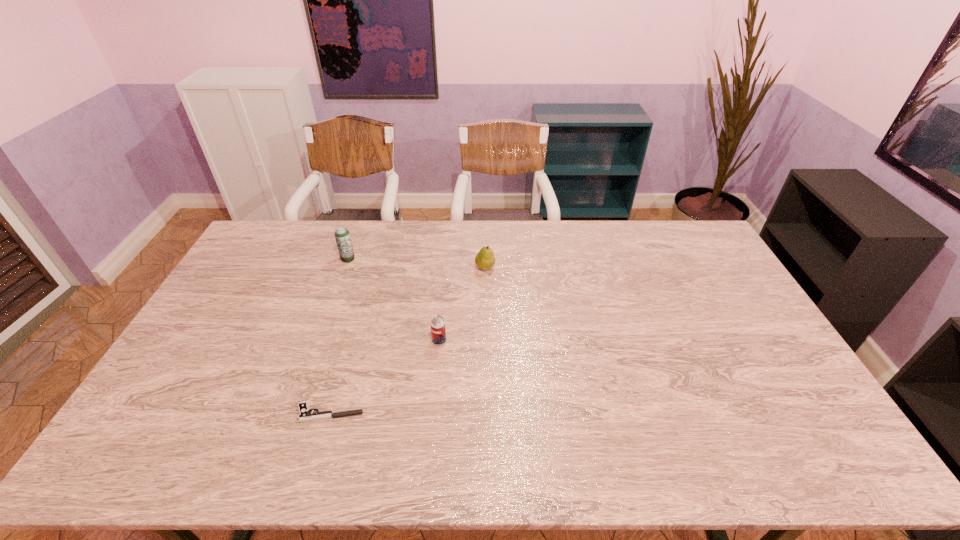
Find the location of a particular element. The image size is (960, 540). free space between the pear and the tallest object is located at coordinates (417, 263).

Locate an element on the screen. The image size is (960, 540). vacant point located between the pistol and the farther beer can is located at coordinates (339, 336).

Where is `free space between the left beer can and the pear`? The image size is (960, 540). free space between the left beer can and the pear is located at coordinates 417,263.

Find the location of a particular element. unoccupied position between the pear and the nearest object is located at coordinates (407, 340).

Identify the location of free spot between the third tallest object and the rightmost object. This screenshot has width=960, height=540. click(462, 304).

You are a GUI agent. You are given a task and a screenshot of the screen. Output one action in this format:
    pyautogui.click(x=<x>, y=<y>)
    Task: Click on the vacant area that lies between the nearest object and the third object from left to right
    This screenshot has height=540, width=960.
    Given the screenshot: What is the action you would take?
    pyautogui.click(x=385, y=377)

Locate an element on the screen. free spot between the taller beer can and the second shortest object is located at coordinates (394, 300).

Identify the location of free spot between the pear and the nearest object. The height and width of the screenshot is (540, 960). (407, 340).

This screenshot has width=960, height=540. Identify the location of free spot between the second nearest object and the pistol. pyautogui.click(x=385, y=377).

Where is `free space between the shortest object and the tallest object`? free space between the shortest object and the tallest object is located at coordinates pyautogui.click(x=339, y=336).